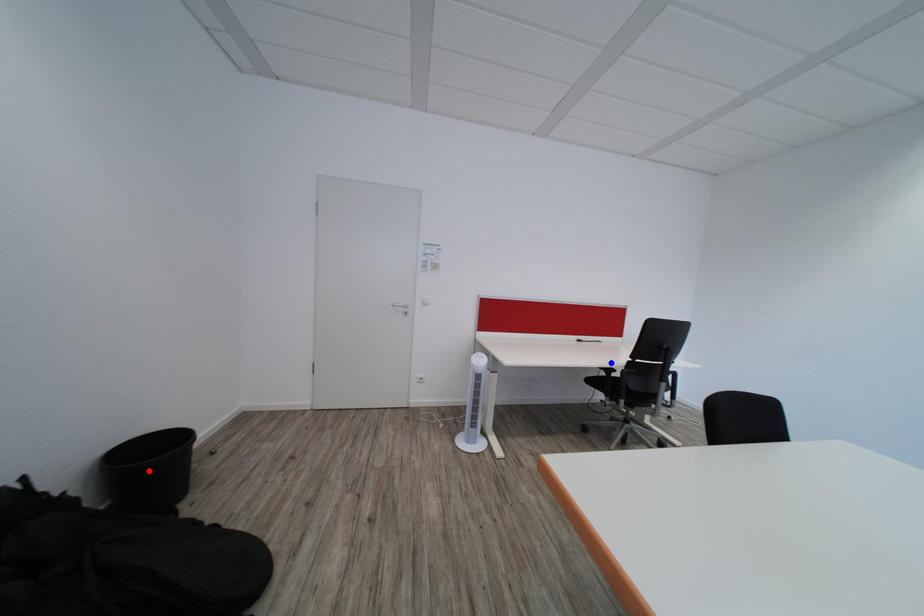
Question: In the image, two points are highlighted. Which point is nearer to the camera? Reply with the corresponding letter.

Choices:
 (A) blue point
 (B) red point

Answer: (B)